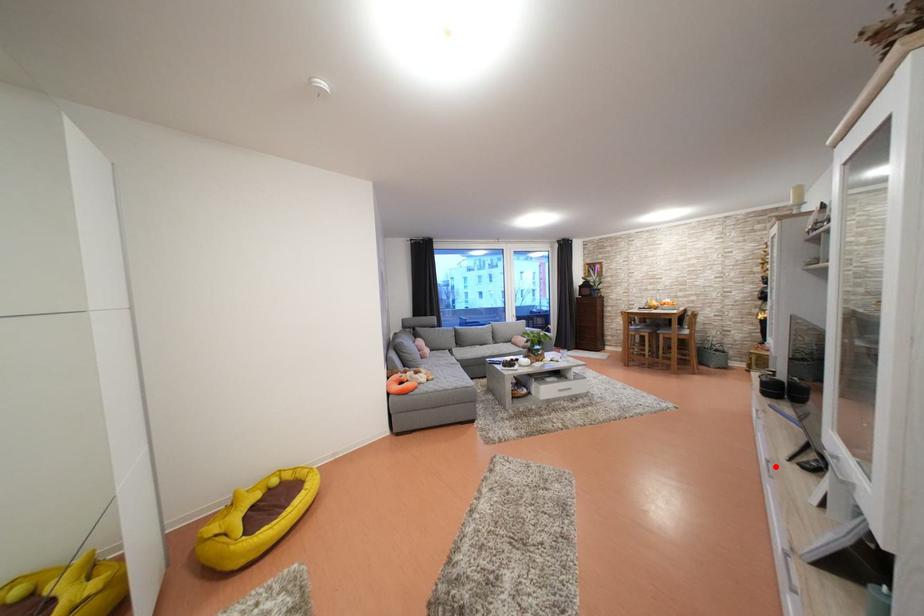
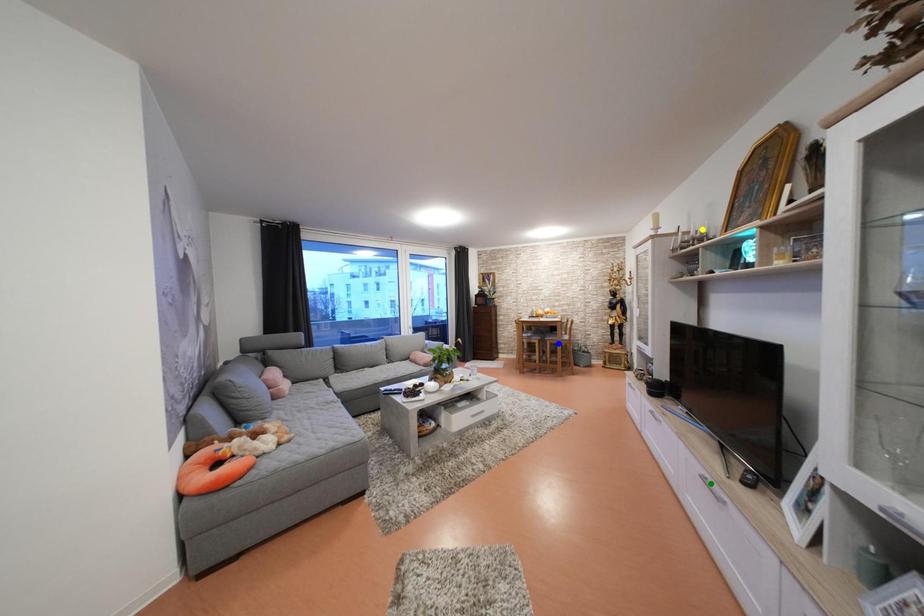
Question: I am providing you with two images of the same scene from different viewpoints. A red point is marked on the first image. You are given multiple points on the second image. Which mark in image 2 goes with the point in image 1?

Choices:
 (A) green point
 (B) blue point
 (C) yellow point

Answer: (A)